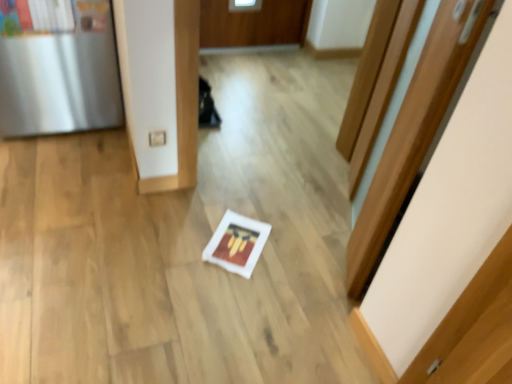
Image resolution: width=512 pixels, height=384 pixels. I want to click on free spot above white matte frame at center (from a real-world perspective), so click(238, 243).